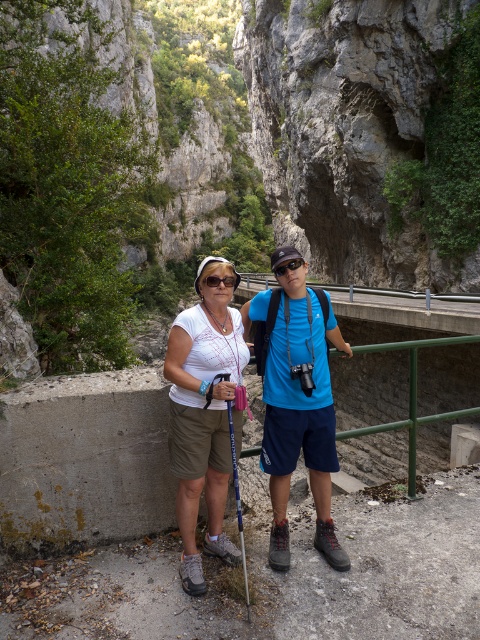
Question: Which object is closer to the camera taking this photo?

Choices:
 (A) blue fabric shirt at center
 (B) concrete path at lower center

Answer: (B)

Question: Considering the relative positions of white fabric shirt at center and black matte sunglasses at center in the image provided, where is white fabric shirt at center located with respect to black matte sunglasses at center?

Choices:
 (A) below
 (B) above

Answer: (A)

Question: Is blue fabric shirt at center positioned behind black matte sunglasses at center?

Choices:
 (A) no
 (B) yes

Answer: (A)

Question: Which of the following is the farthest from the observer?

Choices:
 (A) (292, 268)
 (B) (201, 435)
 (C) (420, 573)
 (D) (309, 346)

Answer: (A)

Question: Is concrete path at lower center thinner than white fabric shirt at center?

Choices:
 (A) no
 (B) yes

Answer: (A)

Question: Which object is the farthest from the blue fabric shirt at center?

Choices:
 (A) white fabric shirt at center
 (B) concrete path at lower center

Answer: (B)